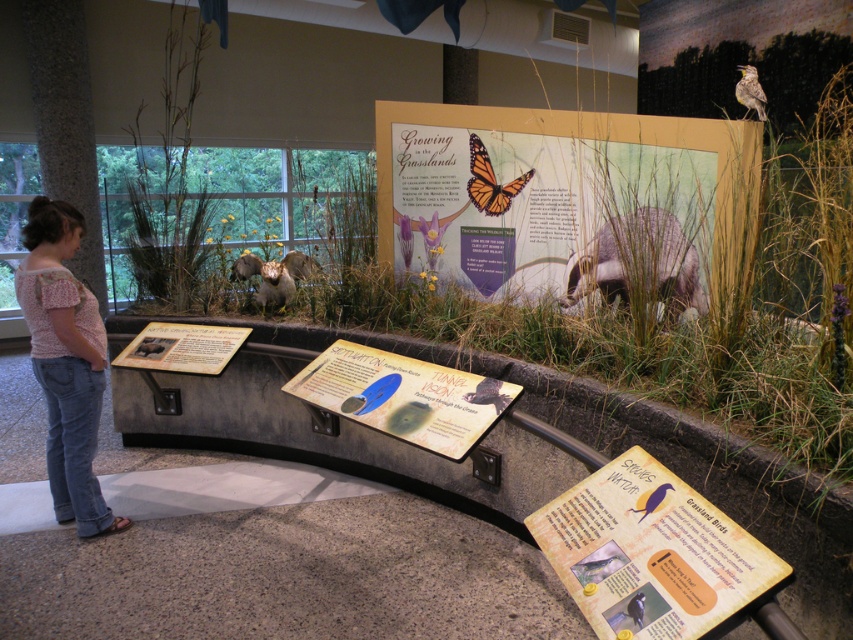
Which is more to the left, orange paper poster at center or wooden signboard at center?

wooden signboard at center

Which is more to the right, orange paper poster at center or wooden signboard at center?

orange paper poster at center is more to the right.

Which is in front, point (613, 579) or point (351, 378)?

Positioned in front is point (613, 579).

This screenshot has height=640, width=853. Identify the location of orange paper poster at center. (653, 554).

Is the position of fuzzy brown badger at center-right less distant than that of yellow speckled bird at upper right?

Yes, fuzzy brown badger at center-right is in front of yellow speckled bird at upper right.

Between point (624, 214) and point (756, 77), which one is positioned in front?

Positioned in front is point (624, 214).

Where is `fuzzy brown badger at center-right`? fuzzy brown badger at center-right is located at coordinates [637, 260].

Which is behind, point (49, 388) or point (314, 378)?

The point (49, 388) is behind.

Can you confirm if pink cotton shirt at left is positioned below wooden signboard at center?

No.

Which is in front, point (71, 428) or point (466, 451)?

Point (466, 451) is more forward.

I want to click on pink cotton shirt at left, so [65, 362].